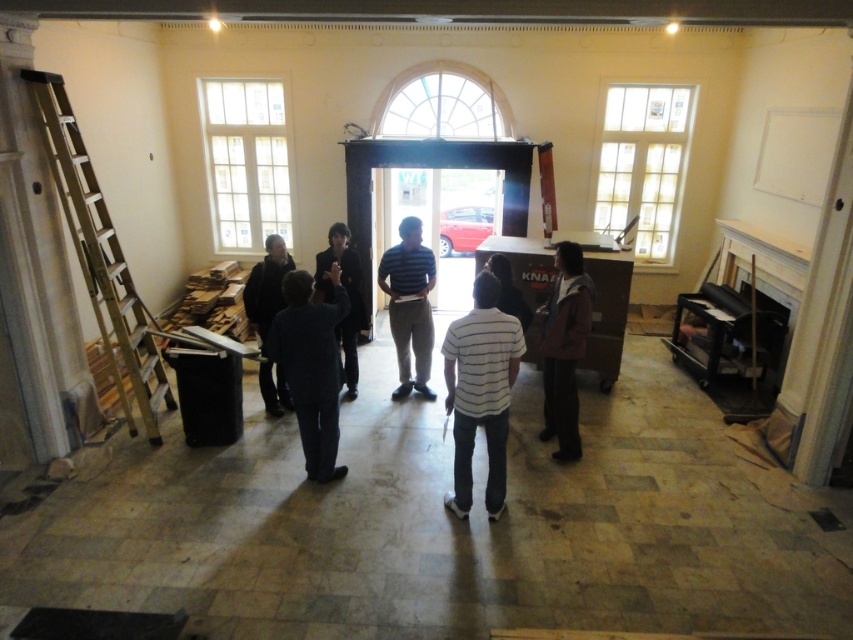
Between brown leather jacket at lower right and dark brown leather jacket at center, which one has more height?

brown leather jacket at lower right is taller.

Between point (560, 400) and point (346, 260), which one is positioned behind?

The point (346, 260) is behind.

Which is behind, point (555, 429) or point (361, 324)?

The point (361, 324) is behind.

Identify the location of brown leather jacket at lower right. The width and height of the screenshot is (853, 640). (564, 349).

Who is higher up, metallic silver ladder at left or striped fabric shirt at center?

metallic silver ladder at left

Who is shorter, metallic silver ladder at left or striped fabric shirt at center?

With less height is striped fabric shirt at center.

Is point (96, 234) behind point (422, 380)?

No, it is not.

Identify the location of metallic silver ladder at left. This screenshot has width=853, height=640. [100, 257].

Consider the image. Who is positioned more to the right, dark gray sweater at center or dark brown leather jacket at center?

Positioned to the right is dark brown leather jacket at center.

Does point (283, 390) come in front of point (347, 358)?

That is True.

Identify the location of dark gray sweater at center. (265, 285).